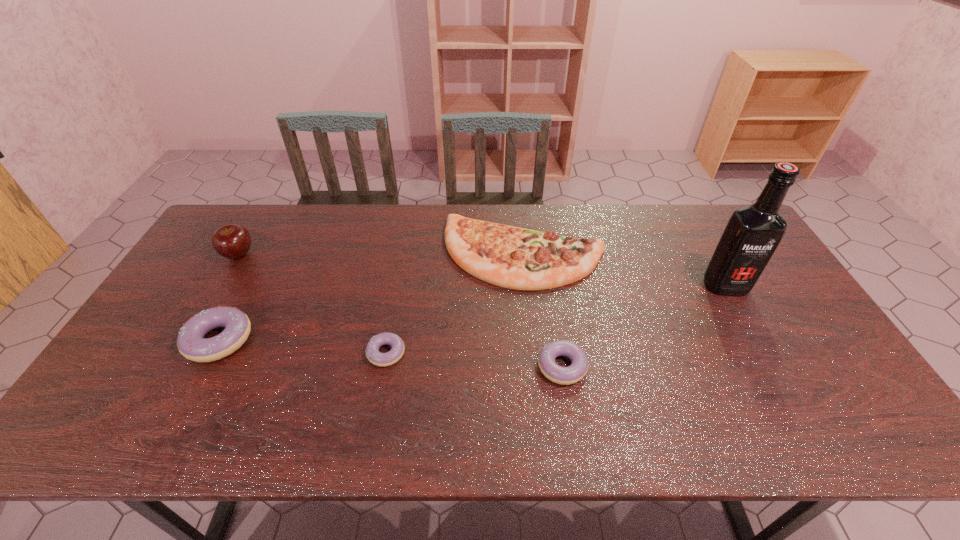
The width and height of the screenshot is (960, 540). Identify the location of the leftmost doughnut. (191, 343).

Identify the location of the shortest doughnut. The height and width of the screenshot is (540, 960). (394, 355).

Locate an element on the screen. The image size is (960, 540). the second doughnut from left to right is located at coordinates (394, 355).

This screenshot has height=540, width=960. Identify the location of the second shortest doughnut. (577, 370).

Identify the location of the rightmost doughnut. This screenshot has width=960, height=540. (577, 370).

Locate an element on the screen. This screenshot has height=540, width=960. pizza is located at coordinates coord(516,258).

Find the location of a particular element. This screenshot has height=540, width=960. the rightmost object is located at coordinates (753, 232).

This screenshot has width=960, height=540. What are the coordinates of `the tallest object` in the screenshot? It's located at (753, 232).

Image resolution: width=960 pixels, height=540 pixels. I want to click on the fifth shortest object, so click(232, 241).

The image size is (960, 540). What are the coordinates of `vacant space located on the right of the tallest doughnut` in the screenshot? It's located at (372, 340).